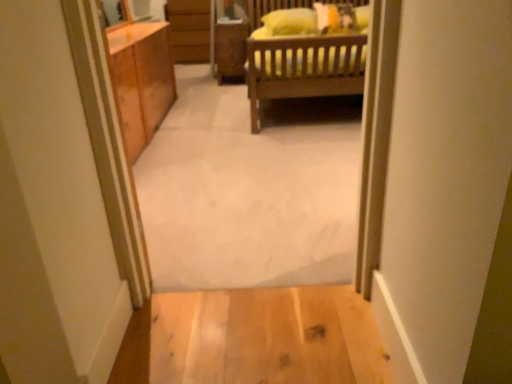
Question: Does light wood floor at lower center, the 2th plain viewed from the top, have a lesser height compared to carpet at center, which is the second plain from bottom to top?

Choices:
 (A) no
 (B) yes

Answer: (B)

Question: Would you say carpet at center, which is the second plain from bottom to top, is part of light wood floor at lower center, the 2th plain viewed from the top,'s contents?

Choices:
 (A) yes
 (B) no

Answer: (B)

Question: Does light wood floor at lower center, the 2th plain viewed from the top, lie in front of carpet at center, which is the second plain from bottom to top?

Choices:
 (A) no
 (B) yes

Answer: (A)

Question: Considering the relative sizes of light wood floor at lower center, arranged as the 1th plain when ordered from the bottom, and carpet at center, the first plain positioned from the top, in the image provided, is light wood floor at lower center, arranged as the 1th plain when ordered from the bottom, taller than carpet at center, the first plain positioned from the top,?

Choices:
 (A) no
 (B) yes

Answer: (A)

Question: Does light wood floor at lower center, arranged as the 1th plain when ordered from the bottom, appear on the right side of carpet at center, the first plain positioned from the top?

Choices:
 (A) no
 (B) yes

Answer: (B)

Question: Considering the positions of yellow soft pillow at upper center and carpet at center, the first plain positioned from the top, in the image, is yellow soft pillow at upper center bigger or smaller than carpet at center, the first plain positioned from the top,?

Choices:
 (A) big
 (B) small

Answer: (B)

Question: Is yellow soft pillow at upper center inside or outside of carpet at center, the first plain positioned from the top?

Choices:
 (A) inside
 (B) outside

Answer: (B)

Question: Considering the relative positions of yellow soft pillow at upper center and carpet at center, the first plain positioned from the top, in the image provided, is yellow soft pillow at upper center to the left or to the right of carpet at center, the first plain positioned from the top,?

Choices:
 (A) right
 (B) left

Answer: (A)

Question: From a real-world perspective, relative to carpet at center, the first plain positioned from the top, is yellow soft pillow at upper center vertically above or below?

Choices:
 (A) above
 (B) below

Answer: (A)

Question: Based on their sizes in the image, would you say light wood floor at lower center, arranged as the 1th plain when ordered from the bottom, is bigger or smaller than wooden cabinet at center?

Choices:
 (A) big
 (B) small

Answer: (B)

Question: Do you think light wood floor at lower center, arranged as the 1th plain when ordered from the bottom, is within wooden cabinet at center, or outside of it?

Choices:
 (A) outside
 (B) inside

Answer: (A)

Question: Is light wood floor at lower center, the 2th plain viewed from the top, taller or shorter than wooden cabinet at center?

Choices:
 (A) short
 (B) tall

Answer: (A)

Question: Is light wood floor at lower center, arranged as the 1th plain when ordered from the bottom, to the left or to the right of wooden cabinet at center in the image?

Choices:
 (A) left
 (B) right

Answer: (B)

Question: Based on their sizes in the image, would you say light wood floor at lower center, the 2th plain viewed from the top, is bigger or smaller than carpet at center, which is the second plain from bottom to top?

Choices:
 (A) big
 (B) small

Answer: (B)

Question: Relative to carpet at center, the first plain positioned from the top, is light wood floor at lower center, arranged as the 1th plain when ordered from the bottom, in front or behind?

Choices:
 (A) front
 (B) behind

Answer: (B)